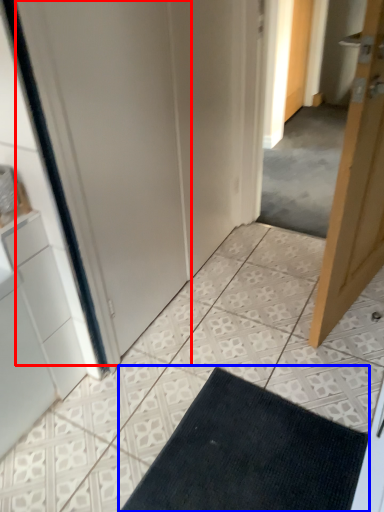
Question: Which object appears farthest to the camera in this image, screen door (highlighted by a red box) or bath mat (highlighted by a blue box)?

Choices:
 (A) screen door
 (B) bath mat

Answer: (B)